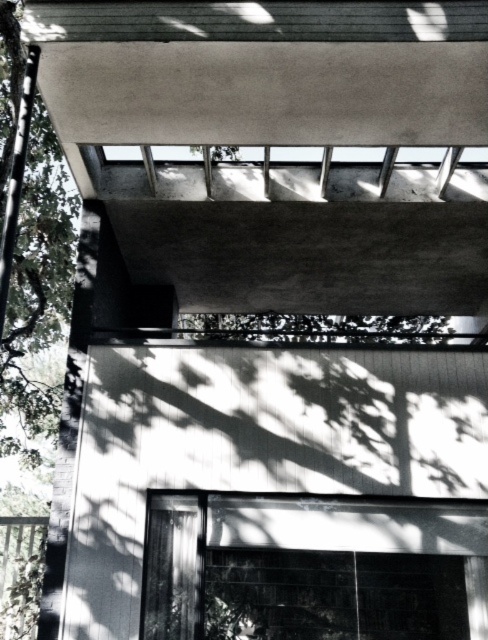
Who is taller, green leafy tree at left or green leafy tree at center?

green leafy tree at left

From the picture: Does green leafy tree at left lie in front of green leafy tree at center?

Yes, it is in front of green leafy tree at center.

Does point (24, 49) come farther from viewer compared to point (229, 337)?

No, it is in front of (229, 337).

Locate an element on the screen. The image size is (488, 640). green leafy tree at left is located at coordinates (37, 291).